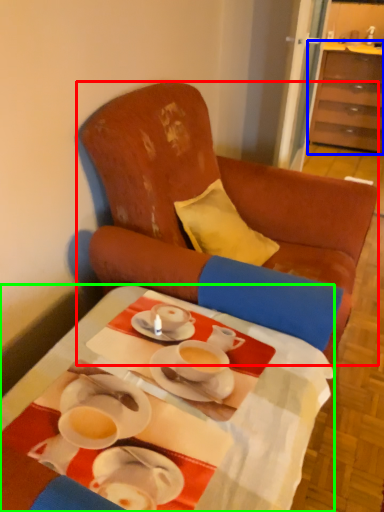
Question: Which object is positioned closest to chair (highlighted by a red box)? Select from cabinetry (highlighted by a blue box) and desk (highlighted by a green box).

Choices:
 (A) cabinetry
 (B) desk

Answer: (B)